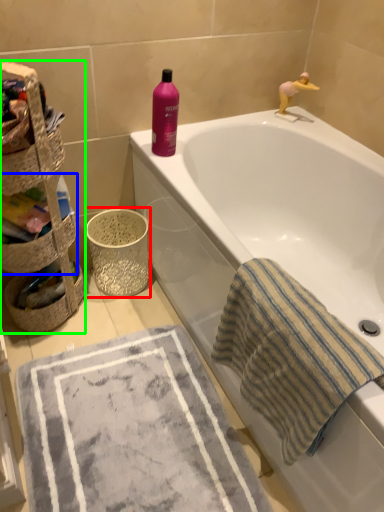
Question: Estimate the real-world distances between objects in this image. Which object is farther from basket container (highlighted by a red box), basket (highlighted by a blue box) or basket (highlighted by a green box)?

Choices:
 (A) basket
 (B) basket

Answer: (A)